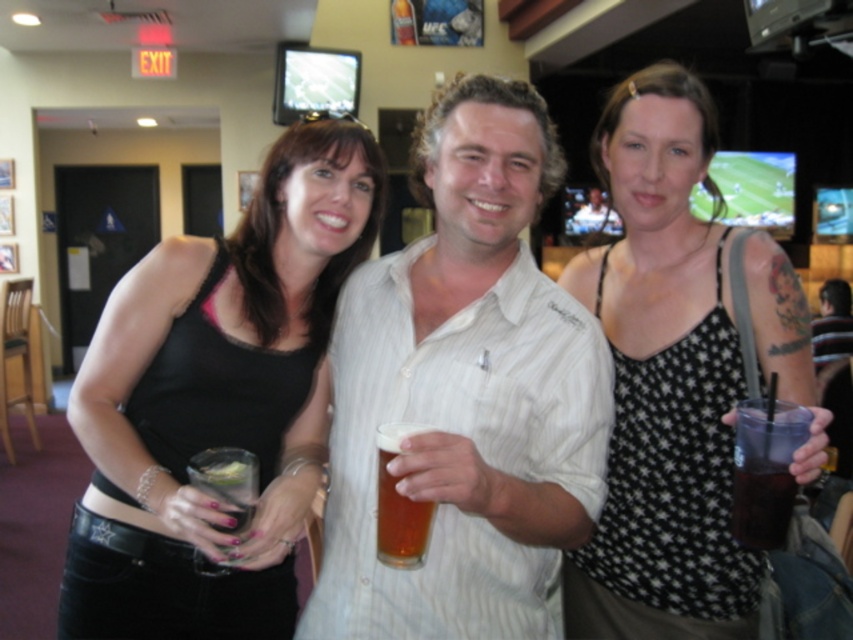
Question: Which of the following is the farthest from the observer?

Choices:
 (A) black star-patterned tank top at center
 (B) black fabric tank top at center

Answer: (B)

Question: Which of the following is the farthest from the observer?

Choices:
 (A) dark brown liquid at lower right
 (B) black fabric tank top at center
 (C) black star-patterned tank top at center
 (D) translucent glass beer at center

Answer: (B)

Question: Based on their relative distances, which object is farther from the translucent glass beer at center?

Choices:
 (A) dark brown liquid at lower right
 (B) white striped shirt at center
 (C) black star-patterned tank top at center

Answer: (C)

Question: Is white striped shirt at center positioned in front of dark brown liquid at lower right?

Choices:
 (A) no
 (B) yes

Answer: (B)

Question: Can you confirm if black star-patterned tank top at center is wider than translucent glass beer at center?

Choices:
 (A) no
 (B) yes

Answer: (B)

Question: Is black fabric tank top at center above dark brown liquid at lower right?

Choices:
 (A) no
 (B) yes

Answer: (B)